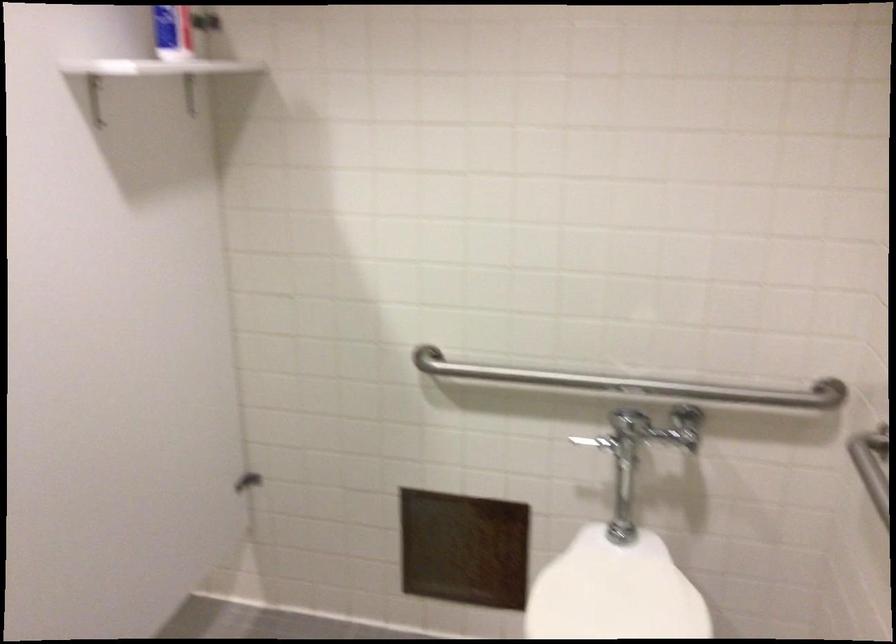
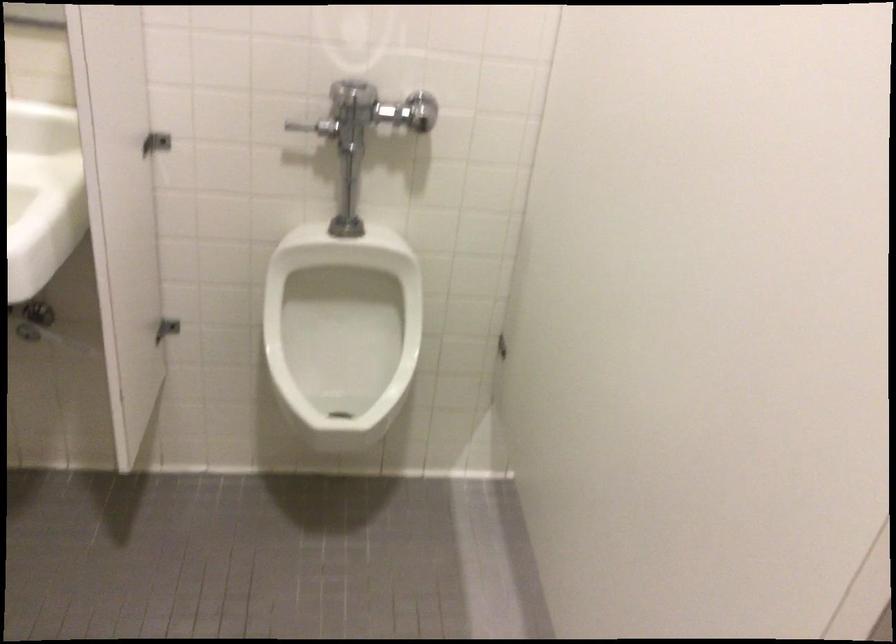
In a continuous first-person perspective shot, in which direction is the camera moving?

The movement direction of the cameraman is left, forward.